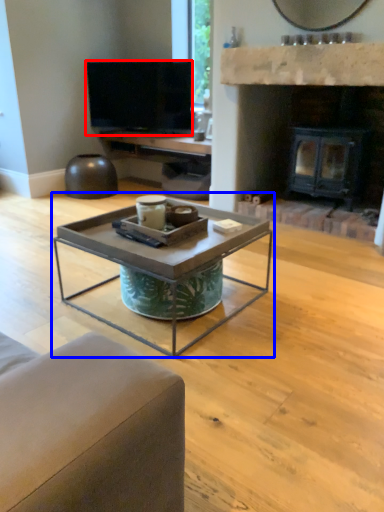
Question: Which point is further to the camera, television (highlighted by a red box) or coffee table (highlighted by a blue box)?

Choices:
 (A) television
 (B) coffee table

Answer: (A)